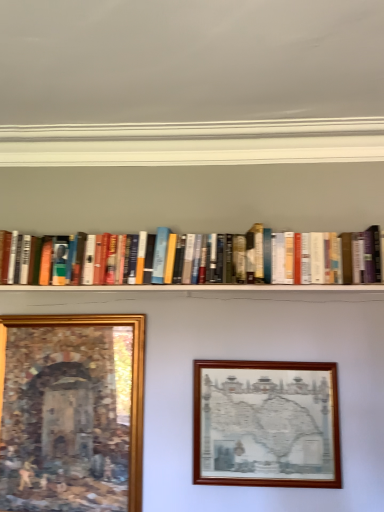
Where is `blank space situated above gold-framed painting at lower left, the 1th picture frame viewed from the left (from a real-world perspective)`? Image resolution: width=384 pixels, height=512 pixels. blank space situated above gold-framed painting at lower left, the 1th picture frame viewed from the left (from a real-world perspective) is located at coordinates (81, 311).